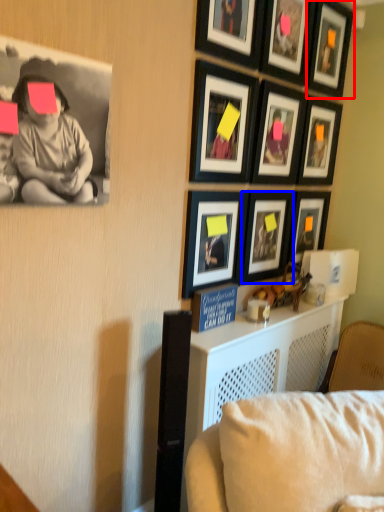
Question: Which point is further to the camera, picture frame (highlighted by a red box) or picture frame (highlighted by a blue box)?

Choices:
 (A) picture frame
 (B) picture frame

Answer: (A)